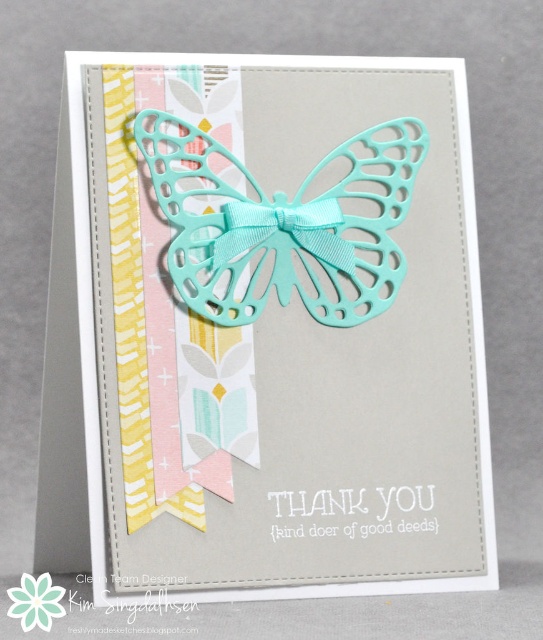
You are designing a greeting card and want to ensure the mint glossy butterfly at center and the tiffany blue grosgrain ribbon at center are proportionate. Based on the image, which object has a greater width?

The mint glossy butterfly at center has a greater width than the tiffany blue grosgrain ribbon at center.

You are designing a greeting card and want to place a sticker on the card. You have two points to choose from, point (180, 157) and point (344, 252). If you want the sticker to be closer to the viewer, which point should you choose?

Point (180, 157) is in front of point (344, 252), so placing the sticker at point (180, 157) will make it closer to the viewer.

You are designing a greeting card and want to place a matte teal butterfly at upper center and a tiffany blue grosgrain ribbon at center. Based on the scene description, where should you position the matte teal butterfly relative to the tiffany blue grosgrain ribbon?

The matte teal butterfly at upper center should be positioned below the tiffany blue grosgrain ribbon at center.